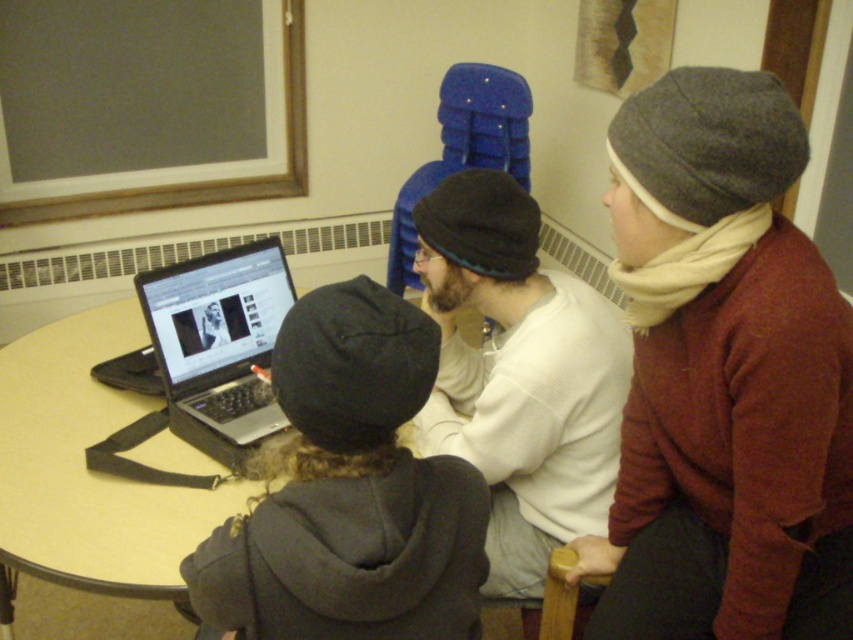
Who is more distant from viewer, (x=260, y=548) or (x=186, y=364)?

The point (x=186, y=364) is more distant.

Does point (427, 504) come closer to viewer compared to point (273, 397)?

Yes, it is.

The height and width of the screenshot is (640, 853). Find the location of `dark gray knit beanie at center`. dark gray knit beanie at center is located at coordinates (350, 492).

Looking at this image, measure the distance between point (512, 392) and camera.

Point (512, 392) and camera are 5.14 feet apart.

The image size is (853, 640). Identify the location of white cotton shirt at center. (519, 376).

Does gray woolen beanie at upper right appear over black matte laptop at center?

No, gray woolen beanie at upper right is not above black matte laptop at center.

Who is more distant from viewer, (712, 189) or (181, 380)?

The point (181, 380) is behind.

Who is more forward, (x=837, y=387) or (x=273, y=282)?

Point (x=837, y=387)

The height and width of the screenshot is (640, 853). I want to click on gray woolen beanie at upper right, so click(724, 378).